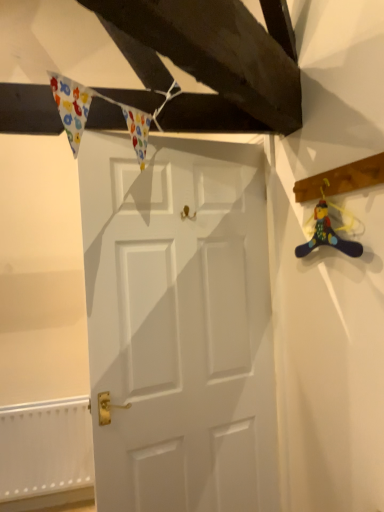
The height and width of the screenshot is (512, 384). What do you see at coordinates (45, 454) in the screenshot?
I see `white textured radiator at lower left` at bounding box center [45, 454].

Where is `white textured radiator at lower left`? The image size is (384, 512). white textured radiator at lower left is located at coordinates (45, 454).

Does white textured radiator at lower left come in front of wooden plank at upper right?

No.

Would you say white textured radiator at lower left contains wooden plank at upper right?

Definitely not — wooden plank at upper right is not inside white textured radiator at lower left.

From the image's perspective, is white textured radiator at lower left on top of wooden plank at upper right?

Actually, white textured radiator at lower left appears below wooden plank at upper right in the image.

Based on the photo, is white textured radiator at lower left positioned with its back to wooden plank at upper right?

No, wooden plank at upper right is not at the back of white textured radiator at lower left.

From the image's perspective, which object appears higher, wooden plank at upper right or white matte door at center?

wooden plank at upper right.

From a real-world perspective, is wooden plank at upper right beneath white matte door at center?

Incorrect, from a real-world perspective, wooden plank at upper right is higher than white matte door at center.

From the picture: Is wooden plank at upper right behind white matte door at center?

No, the depth of wooden plank at upper right is less than that of white matte door at center.

Can we say wooden plank at upper right lies outside white matte door at center?

wooden plank at upper right lies outside white matte door at center's area.

Is white matte door at center wider or thinner than wooden plank at upper right?

Considering their sizes, white matte door at center looks slimmer than wooden plank at upper right.

Locate an element on the screen. door below the wooden plank at upper right (from the image's perspective) is located at coordinates (179, 325).

Is white matte door at center shorter than wooden plank at upper right?

In fact, white matte door at center may be taller than wooden plank at upper right.

Which is behind, point (311, 246) or point (382, 180)?

Positioned behind is point (311, 246).

Which of these two, matte plastic toy at right or wooden plank at upper right, is smaller?

matte plastic toy at right is smaller.

Does matte plastic toy at right appear on the right side of wooden plank at upper right?

No, matte plastic toy at right is not to the right of wooden plank at upper right.

Is matte plastic toy at right not close to wooden plank at upper right?

No, matte plastic toy at right is in close proximity to wooden plank at upper right.

Does white textured radiator at lower left have a lesser width compared to matte plastic toy at right?

Incorrect, the width of white textured radiator at lower left is not less than that of matte plastic toy at right.

Between white textured radiator at lower left and matte plastic toy at right, which one has more height?

With more height is white textured radiator at lower left.

The height and width of the screenshot is (512, 384). I want to click on radiator behind the matte plastic toy at right, so click(45, 454).

Is white textured radiator at lower left positioned with its back to matte plastic toy at right?

No, matte plastic toy at right is not at the back of white textured radiator at lower left.

From the picture: Which is closer, (355, 179) or (76, 494)?

Point (355, 179) is closer to the camera than point (76, 494).

Does wooden plank at upper right appear on the right side of white textured radiator at lower left?

Correct, you'll find wooden plank at upper right to the right of white textured radiator at lower left.

Is wooden plank at upper right turned away from white textured radiator at lower left?

No, wooden plank at upper right's orientation is not away from white textured radiator at lower left.

Is wooden plank at upper right shorter than white textured radiator at lower left?

Yes.

Which object is closer to the camera, wooden plank at upper right or matte plastic toy at right?

wooden plank at upper right is closer to the camera.

Considering the sizes of objects wooden plank at upper right and matte plastic toy at right in the image provided, who is taller, wooden plank at upper right or matte plastic toy at right?

With more height is matte plastic toy at right.

Can you tell me how much wooden plank at upper right and matte plastic toy at right differ in facing direction?

The angle between the facing direction of wooden plank at upper right and the facing direction of matte plastic toy at right is 1.14 degrees.

Which point is more distant from viewer, (325, 172) or (302, 254)?

Point (302, 254)

I want to click on plank above the white textured radiator at lower left (from a real-world perspective), so click(341, 179).

Image resolution: width=384 pixels, height=512 pixels. In order to click on door that appears below the wooden plank at upper right (from a real-world perspective) in this screenshot , I will do `click(179, 325)`.

Considering their positions, is matte plastic toy at right positioned closer to wooden plank at upper right than white matte door at center?

matte plastic toy at right is positioned closer to the anchor wooden plank at upper right.

Looking at the image, which one is located closer to white matte door at center, matte plastic toy at right or white textured radiator at lower left?

Among the two, matte plastic toy at right is located nearer to white matte door at center.

Consider the image. Based on their spatial positions, is wooden plank at upper right or white matte door at center closer to matte plastic toy at right?

Based on the image, wooden plank at upper right appears to be nearer to matte plastic toy at right.

Based on their spatial positions, is matte plastic toy at right or white textured radiator at lower left further from wooden plank at upper right?

white textured radiator at lower left.

Estimate the real-world distances between objects in this image. Which object is closer to matte plastic toy at right, white matte door at center or white textured radiator at lower left?

white matte door at center lies closer to matte plastic toy at right than the other object.

Estimate the real-world distances between objects in this image. Which object is closer to matte plastic toy at right, white textured radiator at lower left or wooden plank at upper right?

wooden plank at upper right is positioned closer to the anchor matte plastic toy at right.

Considering their positions, is white matte door at center positioned further to white textured radiator at lower left than matte plastic toy at right?

matte plastic toy at right is further to white textured radiator at lower left.

Which object lies nearer to the anchor point white textured radiator at lower left, wooden plank at upper right or matte plastic toy at right?

The object closer to white textured radiator at lower left is matte plastic toy at right.

The width and height of the screenshot is (384, 512). I want to click on miniature between wooden plank at upper right and white matte door at center vertically, so click(328, 229).

You are a GUI agent. You are given a task and a screenshot of the screen. Output one action in this format:
    pyautogui.click(x=<x>, y=<y>)
    Task: Click on the door between wooden plank at upper right and white textured radiator at lower left in the vertical direction
    
    Given the screenshot: What is the action you would take?
    pyautogui.click(x=179, y=325)

Image resolution: width=384 pixels, height=512 pixels. Identify the location of door located between white textured radiator at lower left and matte plastic toy at right in the left-right direction. (179, 325).

At what (x,y) coordinates should I click in order to perform the action: click on miniature located between white textured radiator at lower left and wooden plank at upper right in the left-right direction. Please return your answer as a coordinate pair (x, y). This screenshot has width=384, height=512. Looking at the image, I should click on pos(328,229).